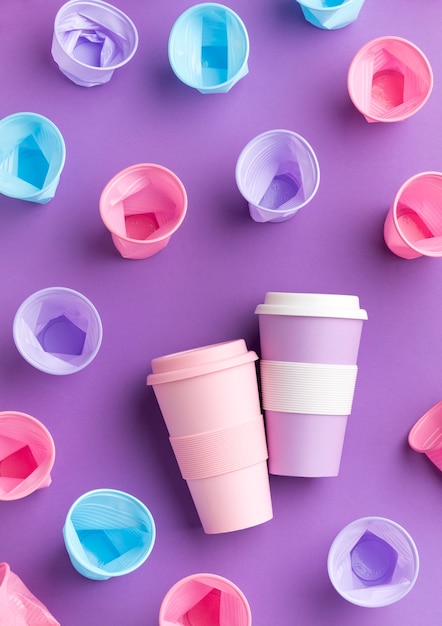
The image size is (442, 626). What are the coordinates of `blue cups` in the screenshot? It's located at (105, 533), (35, 151), (191, 58), (316, 13).